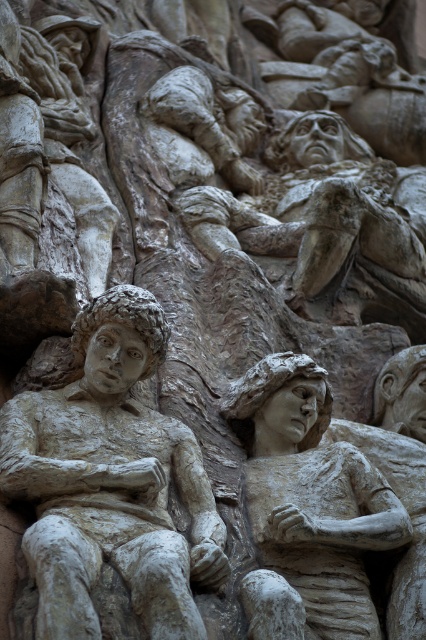
Between white stone figure at center and matte stone figure at center, which one has less height?

Standing shorter between the two is matte stone figure at center.

Where is `white stone figure at center`? The image size is (426, 640). white stone figure at center is located at coordinates (111, 481).

You are a GUI agent. You are given a task and a screenshot of the screen. Output one action in this format:
    pyautogui.click(x=<x>, y=<y>)
    Task: Click on the white stone figure at center
    
    Given the screenshot: What is the action you would take?
    pyautogui.click(x=111, y=481)